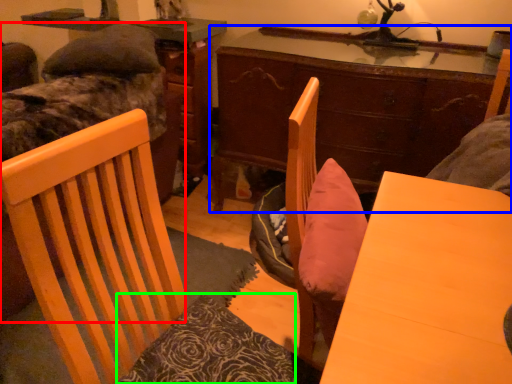
Question: Considering the real-world distances, which object is farthest from bed (highlighted by a red box)? desk (highlighted by a blue box) or pillow (highlighted by a green box)?

Choices:
 (A) desk
 (B) pillow

Answer: (B)